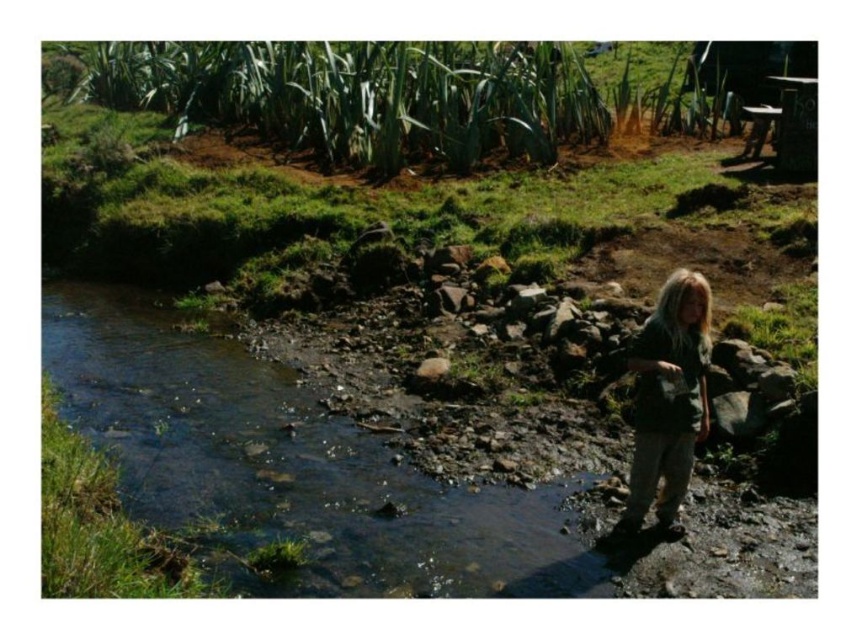
Question: Can you confirm if clear water at stream center is positioned to the right of green fabric shirt at lower right?

Choices:
 (A) yes
 (B) no

Answer: (B)

Question: Which point is closer to the camera?

Choices:
 (A) green fabric shirt at lower right
 (B) clear water at stream center

Answer: (B)

Question: Is clear water at stream center smaller than green fabric shirt at lower right?

Choices:
 (A) yes
 (B) no

Answer: (B)

Question: Is clear water at stream center to the left of green fabric shirt at lower right from the viewer's perspective?

Choices:
 (A) yes
 (B) no

Answer: (A)